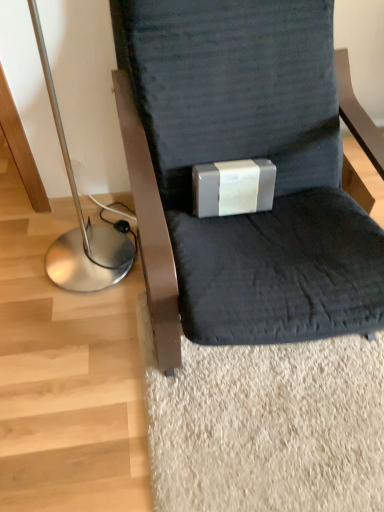
In order to face matte gray box at center, should I rotate leftwards or rightwards?

It's best to rotate right around 5.756 degrees.

Identify the location of matte gray box at center. (233, 187).

Identify the location of silver metallic floor lamp at left. (80, 219).

In order to face silver metallic floor lamp at left, should I rotate leftwards or rightwards?

Rotate left and turn 16.191 degrees.

Where is `matte gray box at center`? This screenshot has width=384, height=512. matte gray box at center is located at coordinates (233, 187).

Is point (227, 105) positioned in front of point (251, 206)?

Yes, point (227, 105) is in front of point (251, 206).

Between matte gray cushion at center and matte gray box at center, which one has more height?

With more height is matte gray cushion at center.

From the picture: Between matte gray cushion at center and matte gray box at center, which one has smaller width?

matte gray box at center.

This screenshot has width=384, height=512. In order to click on chair on the right side of matte gray box at center in this screenshot , I will do `click(243, 158)`.

Which object is thinner, matte gray cushion at center or silver metallic floor lamp at left?

silver metallic floor lamp at left.

Who is bigger, matte gray cushion at center or silver metallic floor lamp at left?

matte gray cushion at center.

From the image's perspective, which is above, matte gray cushion at center or silver metallic floor lamp at left?

silver metallic floor lamp at left appears higher in the image.

Between matte gray cushion at center and silver metallic floor lamp at left, which one has less height?

With less height is silver metallic floor lamp at left.

Is matte gray box at center situated inside matte gray cushion at center or outside?

matte gray box at center is located inside matte gray cushion at center.

Looking at this image, which object is closer to the camera, matte gray box at center or matte gray cushion at center?

matte gray cushion at center is closer to the camera.

Can you confirm if matte gray box at center is shorter than matte gray cushion at center?

Yes.

Can you tell me how much matte gray box at center and matte gray cushion at center differ in facing direction?

The facing directions of matte gray box at center and matte gray cushion at center are 3.71 degrees apart.

From the picture: Who is shorter, silver metallic floor lamp at left or matte gray cushion at center?

silver metallic floor lamp at left.

I want to click on bedside lamp located on the left of matte gray cushion at center, so click(x=80, y=219).

Does point (63, 273) appear closer or farther from the camera than point (186, 223)?

Point (63, 273) is farther from the camera than point (186, 223).

Is silver metallic floor lamp at left situated inside matte gray cushion at center or outside?

silver metallic floor lamp at left is not inside matte gray cushion at center, it's outside.

How different are the orientations of matte gray box at center and silver metallic floor lamp at left in degrees?

3.59 degrees separate the facing orientations of matte gray box at center and silver metallic floor lamp at left.

From the image's perspective, between matte gray box at center and silver metallic floor lamp at left, who is located below?

From the image's view, matte gray box at center is below.

Can you confirm if matte gray box at center is positioned to the right of silver metallic floor lamp at left?

Indeed, matte gray box at center is positioned on the right side of silver metallic floor lamp at left.

Considering the sizes of matte gray box at center and silver metallic floor lamp at left in the image, is matte gray box at center taller or shorter than silver metallic floor lamp at left?

Clearly, matte gray box at center is shorter compared to silver metallic floor lamp at left.

Between silver metallic floor lamp at left and matte gray box at center, which one has larger width?

Wider between the two is silver metallic floor lamp at left.

Considering the positions of points (102, 276) and (197, 168), is point (102, 276) closer to camera compared to point (197, 168)?

No, (102, 276) is further to viewer.

What's the angular difference between silver metallic floor lamp at left and matte gray box at center's facing directions?

The angular difference between silver metallic floor lamp at left and matte gray box at center is 3.59 degrees.

Is silver metallic floor lamp at left touching matte gray box at center?

silver metallic floor lamp at left and matte gray box at center are not in contact.

At what (x,y) coordinates should I click in order to perform the action: click on box that is behind the matte gray cushion at center. Please return your answer as a coordinate pair (x, y). This screenshot has width=384, height=512. Looking at the image, I should click on (233, 187).

Find the location of a particular element. chair above the silver metallic floor lamp at left (from a real-world perspective) is located at coordinates (243, 158).

Which object lies further to the anchor point matte gray cushion at center, silver metallic floor lamp at left or matte gray box at center?

The object further to matte gray cushion at center is silver metallic floor lamp at left.

Based on their spatial positions, is matte gray cushion at center or matte gray box at center further from silver metallic floor lamp at left?

Among the two, matte gray cushion at center is located further to silver metallic floor lamp at left.

Based on their spatial positions, is matte gray box at center or matte gray cushion at center closer to silver metallic floor lamp at left?

matte gray box at center is positioned closer to the anchor silver metallic floor lamp at left.

Based on their spatial positions, is matte gray cushion at center or silver metallic floor lamp at left further from matte gray box at center?

Based on the image, silver metallic floor lamp at left appears to be further to matte gray box at center.

From the image, which object appears to be nearer to matte gray cushion at center, matte gray box at center or silver metallic floor lamp at left?

Among the two, matte gray box at center is located nearer to matte gray cushion at center.

Considering their positions, is silver metallic floor lamp at left positioned closer to matte gray box at center than matte gray cushion at center?

matte gray cushion at center.

Where is `bedside lamp between matte gray cushion at center and matte gray box at center in the front-back direction`? bedside lamp between matte gray cushion at center and matte gray box at center in the front-back direction is located at coordinates (80, 219).